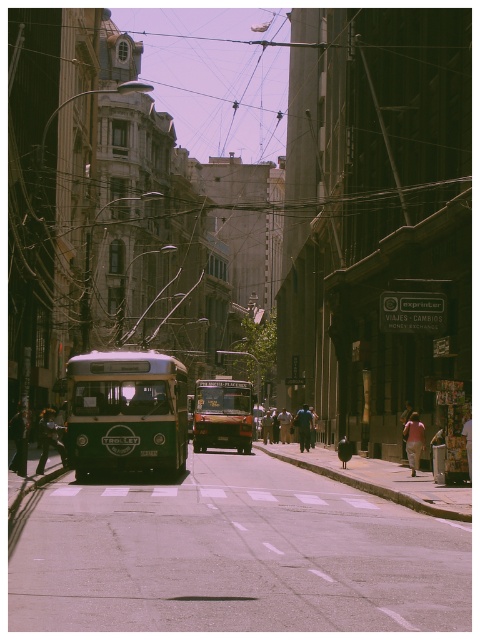
Question: Which of the following is the farthest from the observer?

Choices:
 (A) (201, 385)
 (B) (78, 410)

Answer: (A)

Question: Does green matte trolley at center appear on the left side of metallic brown bus at center?

Choices:
 (A) yes
 (B) no

Answer: (A)

Question: Can you confirm if green matte trolley at center is smaller than metallic brown bus at center?

Choices:
 (A) yes
 (B) no

Answer: (A)

Question: Can you confirm if green matte trolley at center is wider than metallic brown bus at center?

Choices:
 (A) no
 (B) yes

Answer: (A)